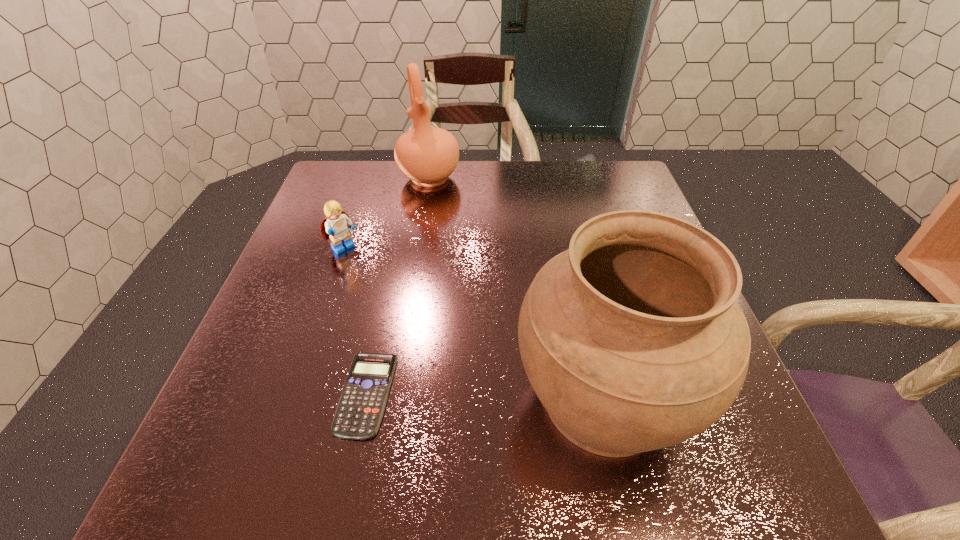
This screenshot has width=960, height=540. Find the location of `free space on the desktop that is between the calculator and the urn and is positioned on the front-facing side of the leftmost object`. free space on the desktop that is between the calculator and the urn and is positioned on the front-facing side of the leftmost object is located at coordinates (508, 397).

The height and width of the screenshot is (540, 960). In order to click on vacant spot on the desktop that is between the calculator and the rightmost object and is positioned on the spout of the farthest object in this screenshot , I will do `click(486, 396)`.